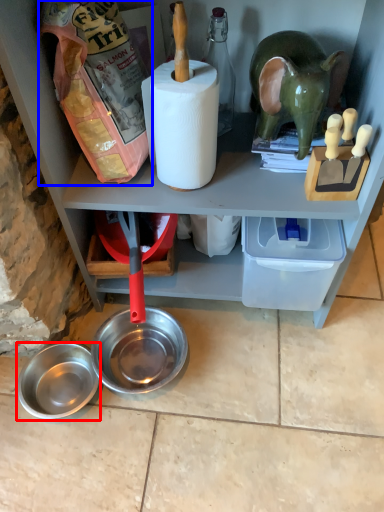
Question: Which object is further to the camera taking this photo, bowl (highlighted by a red box) or stuff (highlighted by a blue box)?

Choices:
 (A) bowl
 (B) stuff

Answer: (A)